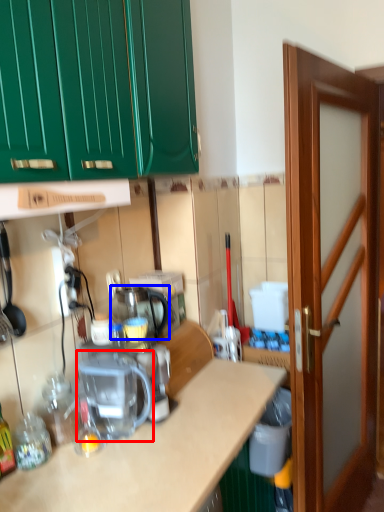
Question: Which object is further to the camera taking this photo, coffee machine (highlighted by a red box) or appliance (highlighted by a blue box)?

Choices:
 (A) coffee machine
 (B) appliance

Answer: (B)